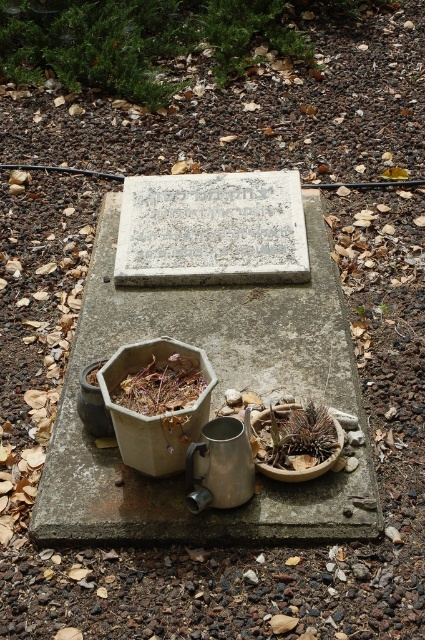
Which is above, gray concrete at center or green succulent at center?

Positioned higher is gray concrete at center.

Which is in front, point (87, 340) or point (277, 426)?

Positioned in front is point (277, 426).

Image resolution: width=425 pixels, height=640 pixels. What are the coordinates of `gray concrete at center` in the screenshot? It's located at (212, 403).

Locate an element on the screen. The image size is (425, 640). gray concrete at center is located at coordinates (212, 403).